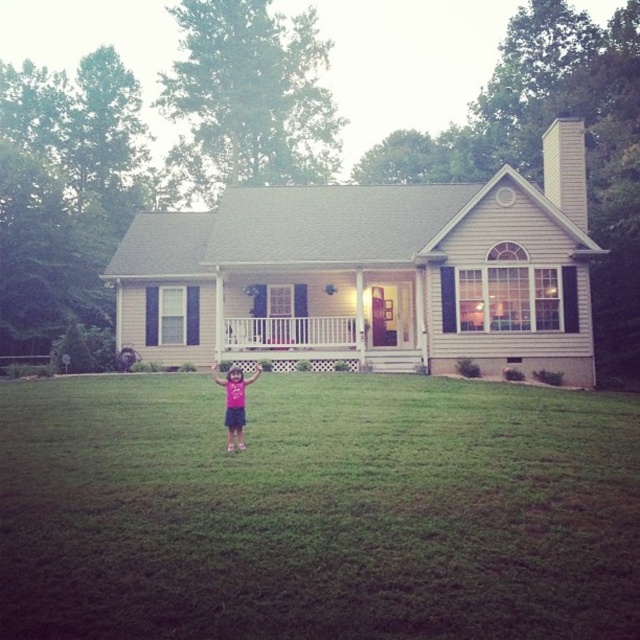
Is white painted wood porch at center shorter than pink fabric dress at center?

Correct, white painted wood porch at center is not as tall as pink fabric dress at center.

At what (x,y) coordinates should I click in order to perform the action: click on white painted wood porch at center. Please return your answer as a coordinate pair (x, y). Looking at the image, I should click on (289, 332).

Identify the location of white painted wood porch at center. (289, 332).

Is green grass at center smaller than pink fabric dress at center?

Incorrect, green grass at center is not smaller in size than pink fabric dress at center.

Does point (449, 605) come closer to viewer compared to point (236, 376)?

Yes, point (449, 605) is closer to viewer.

I want to click on green grass at center, so click(x=317, y=509).

What do you see at coordinates (317, 509) in the screenshot? The height and width of the screenshot is (640, 640). I see `green grass at center` at bounding box center [317, 509].

Is point (356, 516) closer to viewer compared to point (225, 324)?

Yes, point (356, 516) is in front of point (225, 324).

Locate an element on the screen. This screenshot has width=640, height=640. green grass at center is located at coordinates (317, 509).